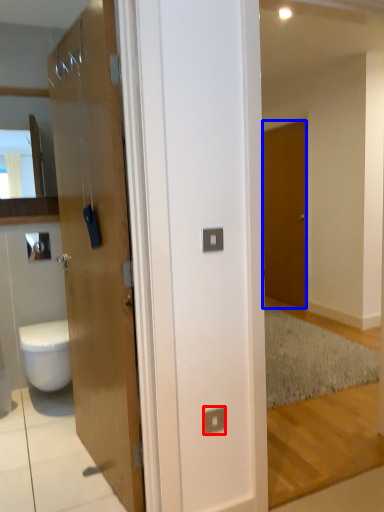
Question: Which object is closer to the camera taking this photo, electric outlet (highlighted by a red box) or door (highlighted by a blue box)?

Choices:
 (A) electric outlet
 (B) door

Answer: (A)